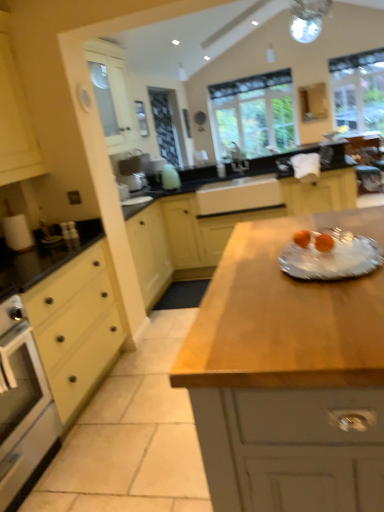
Question: Does white ceramic sink at center, arranged as the second sink when viewed from the top, come behind clear glass plate at center?

Choices:
 (A) yes
 (B) no

Answer: (A)

Question: From a real-world perspective, does white ceramic sink at center, the 1th sink positioned from the bottom, sit lower than clear glass plate at center?

Choices:
 (A) no
 (B) yes

Answer: (B)

Question: Is white ceramic sink at center, arranged as the second sink when viewed from the top, completely or partially outside of clear glass plate at center?

Choices:
 (A) no
 (B) yes

Answer: (B)

Question: Is white ceramic sink at center, arranged as the second sink when viewed from the top, at the right side of clear glass plate at center?

Choices:
 (A) no
 (B) yes

Answer: (A)

Question: Is white ceramic sink at center, the 1th sink positioned from the bottom, next to clear glass plate at center?

Choices:
 (A) no
 (B) yes

Answer: (A)

Question: Visually, is black matte countertop at center, arranged as the 2th countertop when viewed from the front, positioned to the left or to the right of yellow matte drawer at left?

Choices:
 (A) left
 (B) right

Answer: (B)

Question: From their relative heights in the image, would you say black matte countertop at center, arranged as the 2th countertop when viewed from the front, is taller or shorter than yellow matte drawer at left?

Choices:
 (A) short
 (B) tall

Answer: (B)

Question: From a real-world perspective, is black matte countertop at center, arranged as the 2th countertop when viewed from the front, physically located above or below yellow matte drawer at left?

Choices:
 (A) above
 (B) below

Answer: (A)

Question: Is black matte countertop at center, marked as the first countertop in a back-to-front arrangement, wider or thinner than yellow matte drawer at left?

Choices:
 (A) wide
 (B) thin

Answer: (A)

Question: Is clear glass window at upper right, which ranks as the 1th window in right-to-left order, in front of or behind clear glass plate at center in the image?

Choices:
 (A) front
 (B) behind

Answer: (B)

Question: In the image, is clear glass window at upper right, which ranks as the 1th window in right-to-left order, on the left side or the right side of clear glass plate at center?

Choices:
 (A) left
 (B) right

Answer: (B)

Question: Which is correct: clear glass window at upper right, which ranks as the 1th window in right-to-left order, is inside clear glass plate at center, or outside of it?

Choices:
 (A) outside
 (B) inside

Answer: (A)

Question: Looking at the image, does clear glass window at upper right, which ranks as the 1th window in right-to-left order, seem bigger or smaller compared to clear glass plate at center?

Choices:
 (A) small
 (B) big

Answer: (B)

Question: Is yellow matte drawer at left to the left or to the right of white ceramic sink at center, the 1th sink positioned from the bottom, in the image?

Choices:
 (A) right
 (B) left

Answer: (B)

Question: Considering the positions of point (89, 314) and point (254, 200), is point (89, 314) closer or farther from the camera than point (254, 200)?

Choices:
 (A) farther
 (B) closer

Answer: (B)